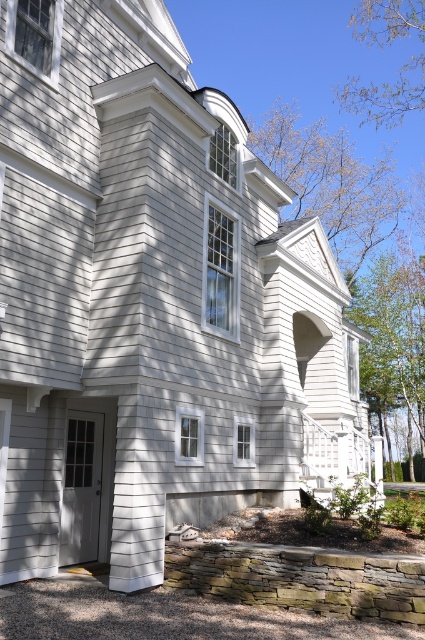
Question: Which point is farther to the camera?

Choices:
 (A) green leafy tree at right
 (B) brown leafy tree at upper center

Answer: (B)

Question: Which of these objects is positioned closest to the green leafy tree at right?

Choices:
 (A) brown leafy tree at upper center
 (B) brown leafy tree at upper right

Answer: (A)

Question: Does brown leafy tree at upper center have a larger size compared to brown leafy tree at upper right?

Choices:
 (A) no
 (B) yes

Answer: (B)

Question: Which of the following is the farthest from the observer?

Choices:
 (A) green leafy tree at right
 (B) brown leafy tree at upper center
 (C) brown leafy tree at upper right

Answer: (B)

Question: Observing the image, what is the correct spatial positioning of brown leafy tree at upper center in reference to green leafy tree at right?

Choices:
 (A) below
 (B) above

Answer: (B)

Question: Can you confirm if green leafy tree at right is positioned above brown leafy tree at upper right?

Choices:
 (A) no
 (B) yes

Answer: (A)